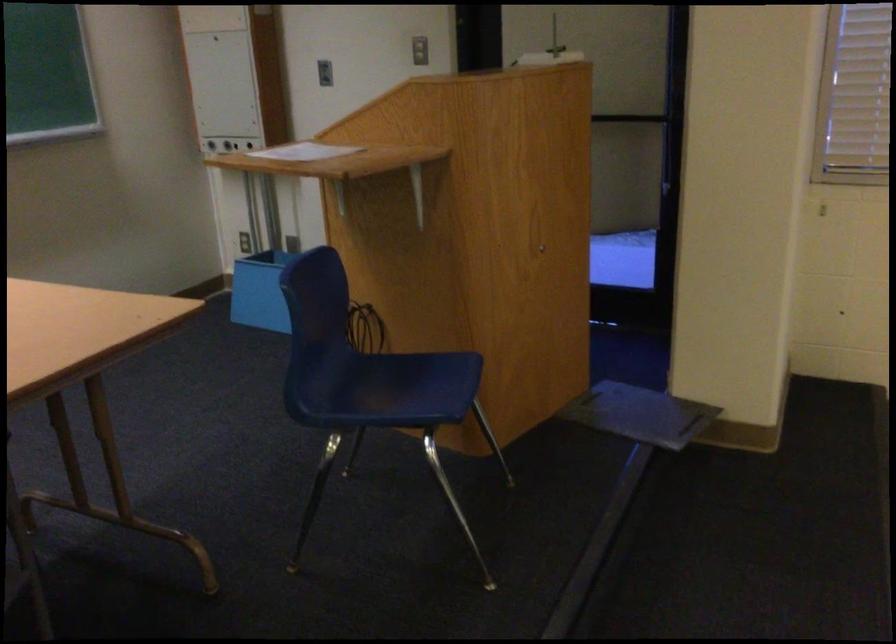
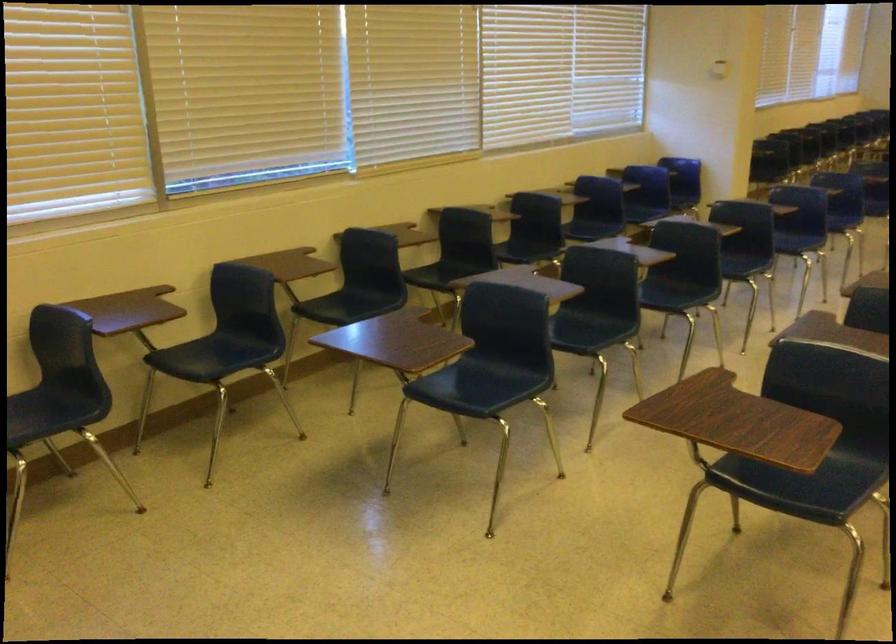
Question: The first image is from the beginning of the video and the second image is from the end. How did the camera likely rotate when shooting the video?

Choices:
 (A) Left
 (B) Right
 (C) Up
 (D) Down

Answer: (B)